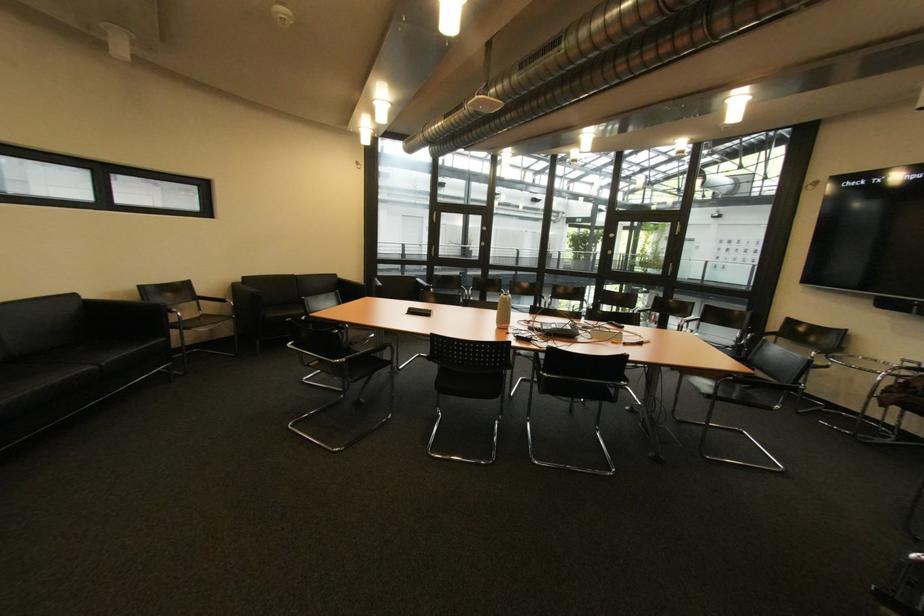
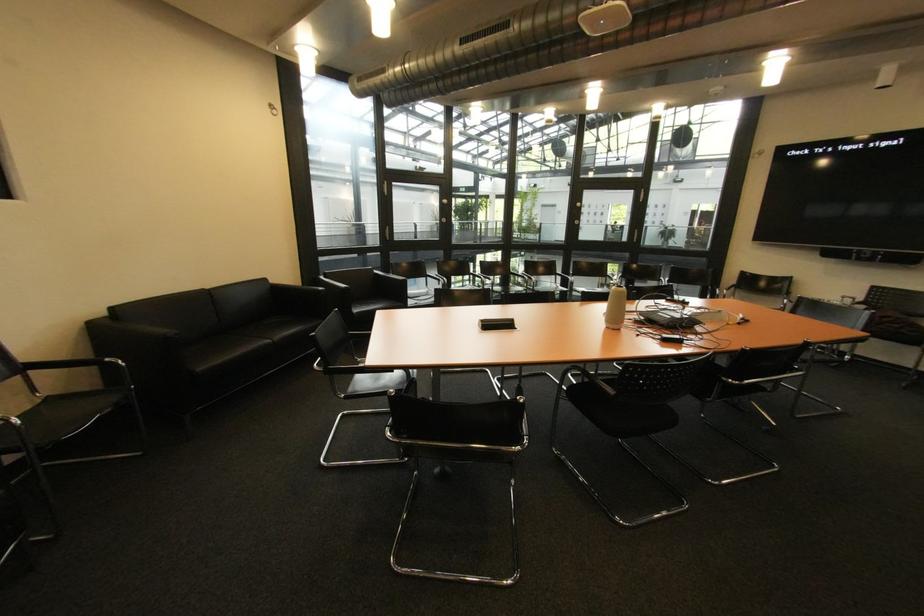
Which direction would the cameraman need to move to produce the second image?

The cameraman moved toward left, forward.